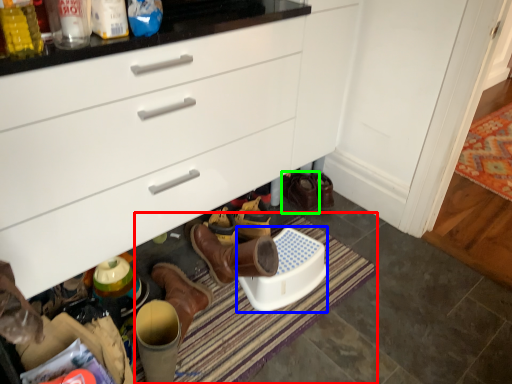
Question: Which object is positioned farthest from bath mat (highlighted by a red box)? Select from corded phone (highlighted by a blue box) and footwear (highlighted by a green box).

Choices:
 (A) corded phone
 (B) footwear

Answer: (B)